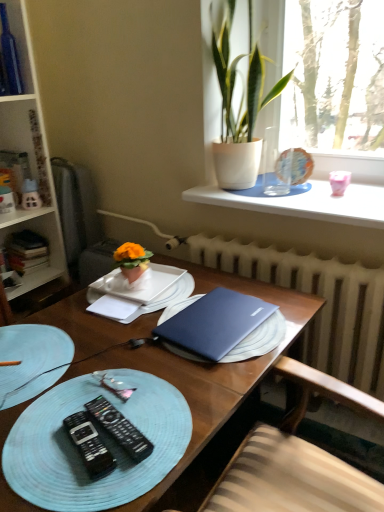
In order to click on blank space situated above blue matte laptop at center (from a real-world perspective) in this screenshot , I will do `click(147, 342)`.